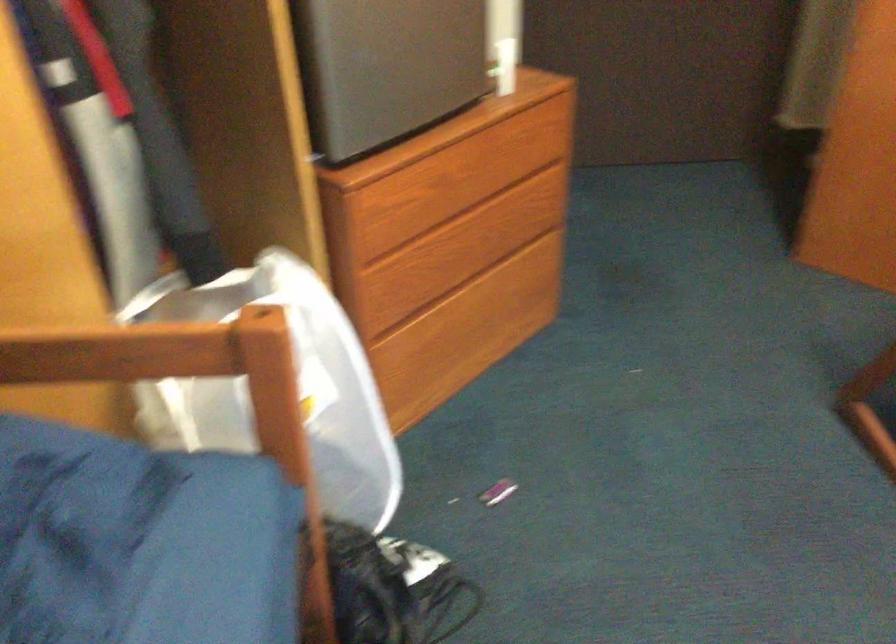
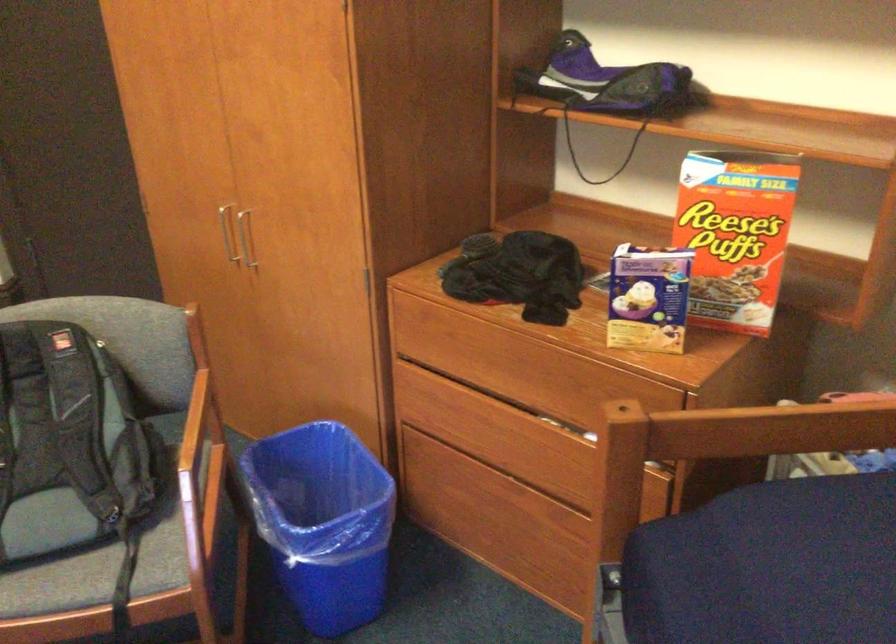
Question: The images are taken continuously from a first-person perspective. In which direction are you moving?

Choices:
 (A) Left
 (B) Right
 (C) Forward
 (D) Backward

Answer: (B)